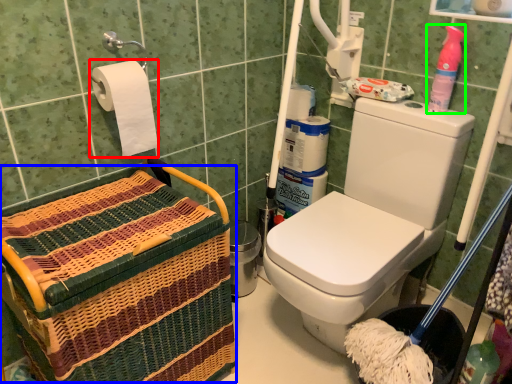
Question: Estimate the real-world distances between objects in this image. Which object is closer to toilet paper (highlighted by a red box), basket (highlighted by a blue box) or cleaning product (highlighted by a green box)?

Choices:
 (A) basket
 (B) cleaning product

Answer: (A)